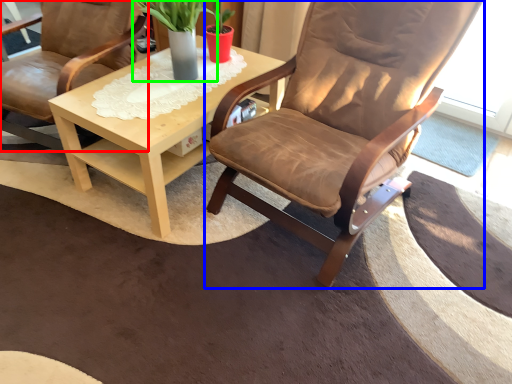
Question: Which object is positioned farthest from chair (highlighted by a red box)? Select from chair (highlighted by a blue box) and houseplant (highlighted by a green box).

Choices:
 (A) chair
 (B) houseplant

Answer: (A)